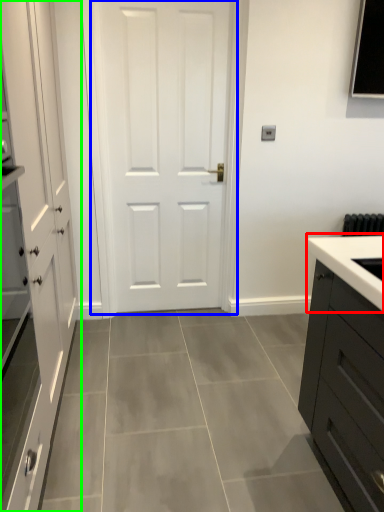
Question: Which is farther away from sink (highlighted by a red box)? door (highlighted by a blue box) or cabinetry (highlighted by a green box)?

Choices:
 (A) door
 (B) cabinetry

Answer: (A)